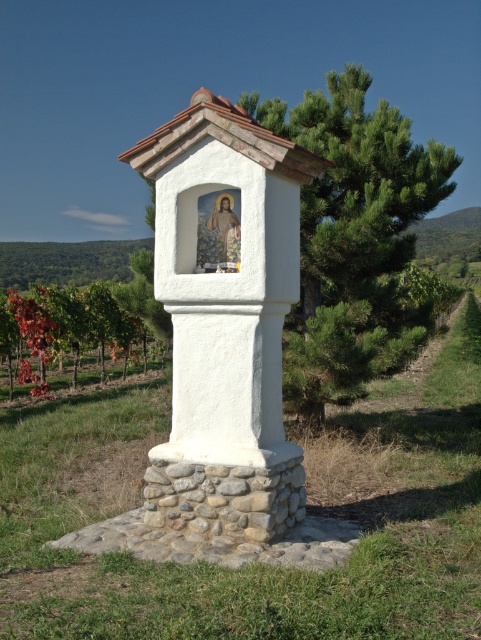
Question: Is white stucco column at center further to camera compared to green leafy tree at center?

Choices:
 (A) no
 (B) yes

Answer: (A)

Question: Can you confirm if white stucco column at center is wider than green leafy tree at center?

Choices:
 (A) no
 (B) yes

Answer: (B)

Question: Is white stucco column at center smaller than reddish-brown vine at left?

Choices:
 (A) no
 (B) yes

Answer: (B)

Question: Among these objects, which one is nearest to the camera?

Choices:
 (A) green leafy tree at center
 (B) reddish-brown vine at left

Answer: (B)

Question: Which point is closer to the camera?

Choices:
 (A) white stucco column at center
 (B) green leafy tree at center
 (C) reddish-brown vine at left

Answer: (A)

Question: Estimate the real-world distances between objects in this image. Which object is closer to the green leafy tree at center?

Choices:
 (A) reddish-brown vine at left
 (B) white stucco column at center

Answer: (B)